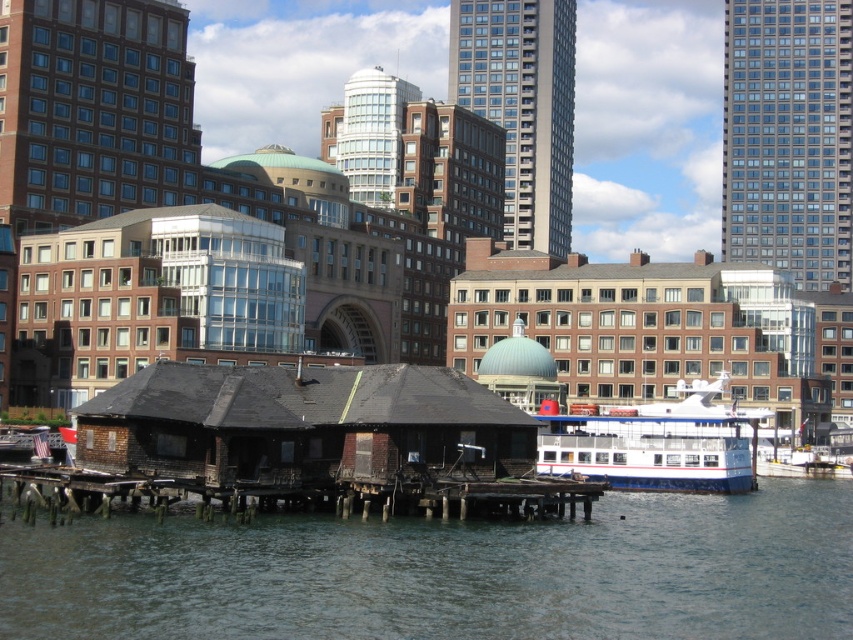
Question: Which object is the closest to the weathered wood hut at center?

Choices:
 (A) white glossy boat at lower right
 (B) smooth glass skyscraper at upper right
 (C) dark gray water at lower center

Answer: (C)

Question: Which of the following is the closest to the observer?

Choices:
 (A) (132, 493)
 (B) (637, 477)
 (C) (810, 337)
 (D) (752, 84)

Answer: (A)

Question: Considering the real-world distances, which object is farthest from the dark gray water at lower center?

Choices:
 (A) brown wooden hut at center
 (B) weathered wood hut at center
 (C) weathered wood dock at center
 (D) white glossy boat at lower right

Answer: (A)

Question: Can you confirm if brown wooden hut at center is thinner than weathered wood dock at center?

Choices:
 (A) yes
 (B) no

Answer: (B)

Question: Is weathered wood hut at center positioned in front of white glossy boat at lower right?

Choices:
 (A) no
 (B) yes

Answer: (B)

Question: Is brown wooden hut at center above white glossy boat at lower right?

Choices:
 (A) no
 (B) yes

Answer: (B)